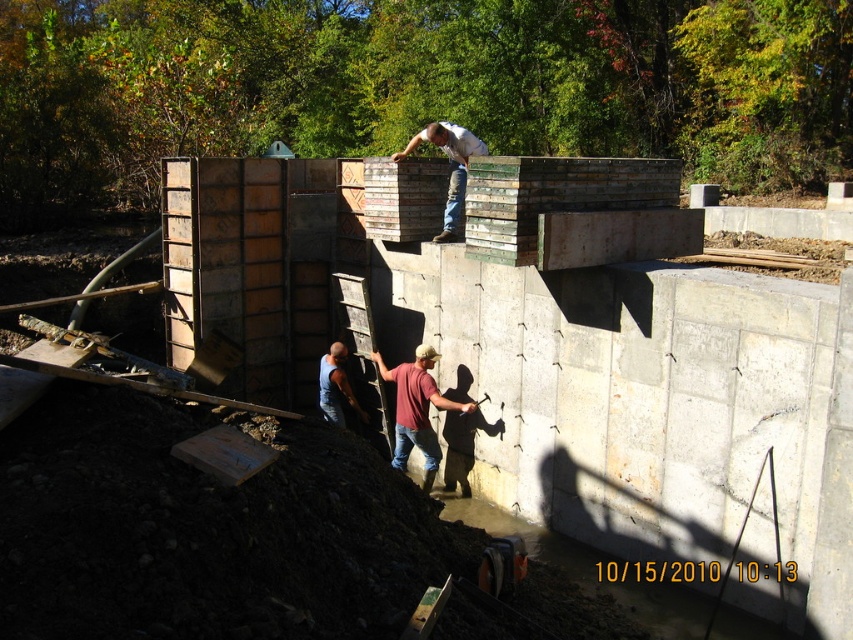
Which is behind, point (460, 150) or point (338, 404)?

The point (338, 404) is more distant.

Is point (454, 202) closer to viewer compared to point (343, 371)?

Yes, point (454, 202) is in front of point (343, 371).

Find the location of a particular element. The image size is (853, 640). matte concrete block at upper center is located at coordinates (450, 164).

Is point (378, 371) positioned in front of point (340, 410)?

Yes, it is in front of point (340, 410).

Does maroon shirt at lower center have a greater height compared to blue denim jeans at lower center?

Yes.

Describe the element at coordinates (416, 410) in the screenshot. I see `maroon shirt at lower center` at that location.

Locate an element on the screen. The height and width of the screenshot is (640, 853). maroon shirt at lower center is located at coordinates (416, 410).

Between maroon shirt at lower center and matte concrete block at upper center, which one has less height?

maroon shirt at lower center is shorter.

Who is lower down, maroon shirt at lower center or matte concrete block at upper center?

maroon shirt at lower center is below.

Which is in front, point (430, 433) or point (453, 205)?

Point (430, 433) is more forward.

This screenshot has height=640, width=853. Identify the location of maroon shirt at lower center. (416, 410).